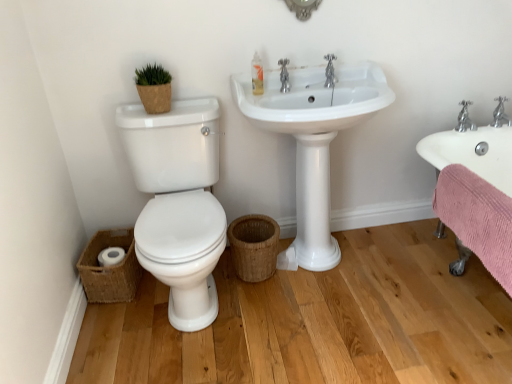
The height and width of the screenshot is (384, 512). I want to click on vacant space in between white glossy toilet at left and woven brown basket at lower left, which is counted as the 2th basket, starting from the right, so pyautogui.click(x=117, y=328).